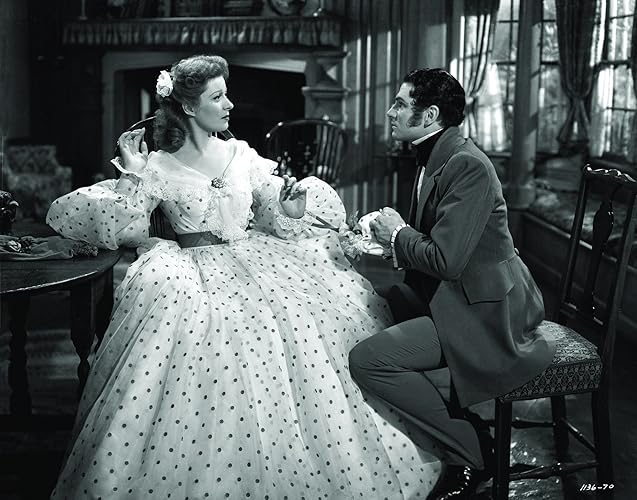
Where is `window`? window is located at coordinates (505, 99).